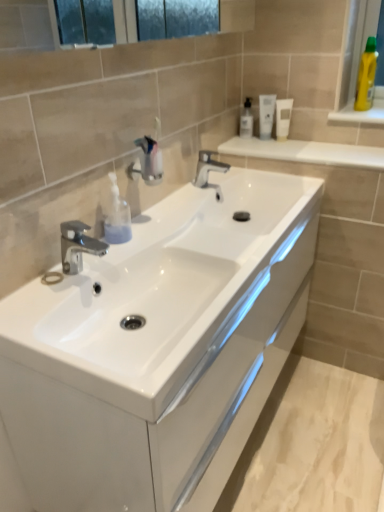
Identify the location of vacant area to the left of white matte tube at upper center, the third mouthwash positioned from the left. This screenshot has height=512, width=384. (251, 145).